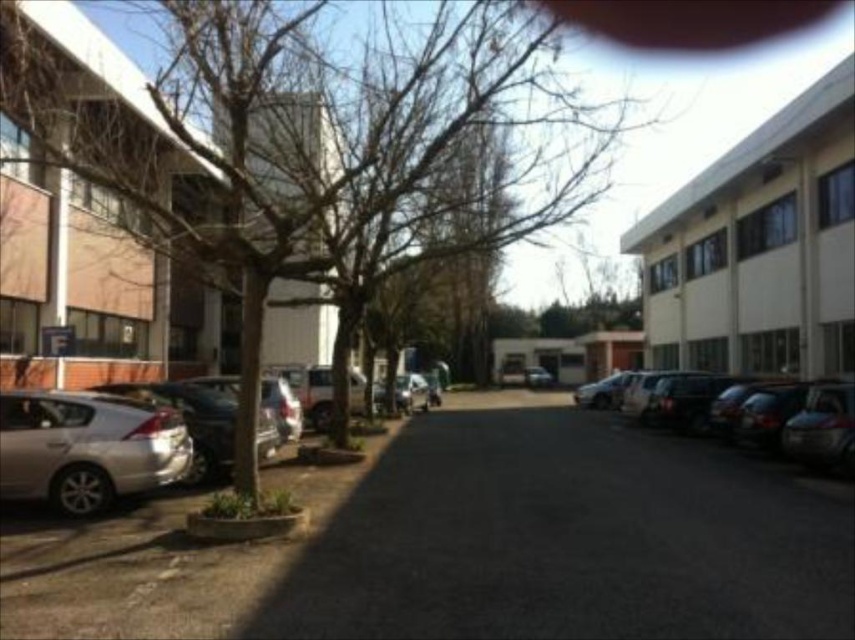
You are a delivery driver who needs to park your truck in the parking area shown. You see the black asphalt parking lot at center and the metallic silver car at center. Which direction should you drive to reach the parking lot first?

The black asphalt parking lot at center is to the left of the metallic silver car at center, so you should drive to the left to reach the parking lot first before the car.

You are standing at the edge of the parking area and see the black asphalt parking lot at center and the brown leafless tree at center. Which object is closer to your left side?

The brown leafless tree at center is closer to your left side because the black asphalt parking lot at center is to the right of it.